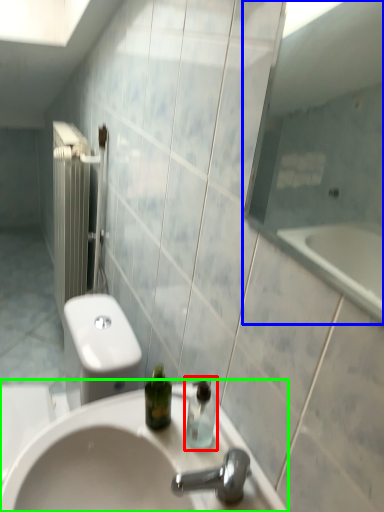
Question: Estimate the real-world distances between objects in this image. Which object is farther from soap dispenser (highlighted by a red box), mirror (highlighted by a blue box) or sink (highlighted by a green box)?

Choices:
 (A) mirror
 (B) sink

Answer: (A)